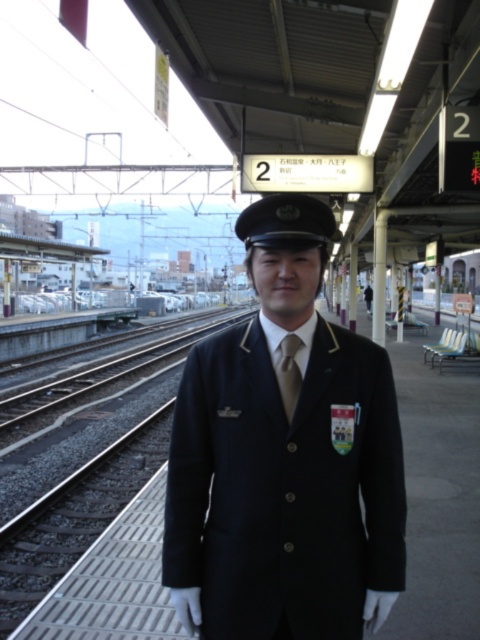
You are a passenger waiting on Platform 2. You see a point at coordinates (153, 298). What does this point represent?

The point at coordinates (153, 298) represents the white glossy train at center.

You are a passenger on the train and want to see the brown satin tie at center worn by the station attendant. Can you see it from your current position on the white glossy train at center?

The white glossy train at center is further to the viewer than the brown satin tie at center, so you can see the brown satin tie at center from your position on the white glossy train at center.

You are a passenger waiting on Platform 2. You see the navy blue uniform at center and the white glossy train at center. How far apart are they from each other?

The navy blue uniform at center and the white glossy train at center are 32.53 meters apart from each other.